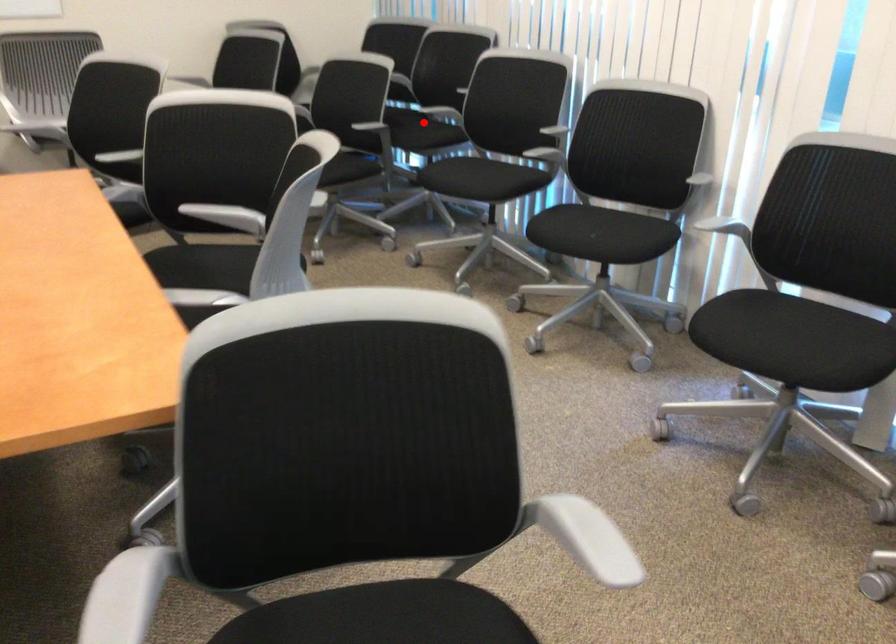
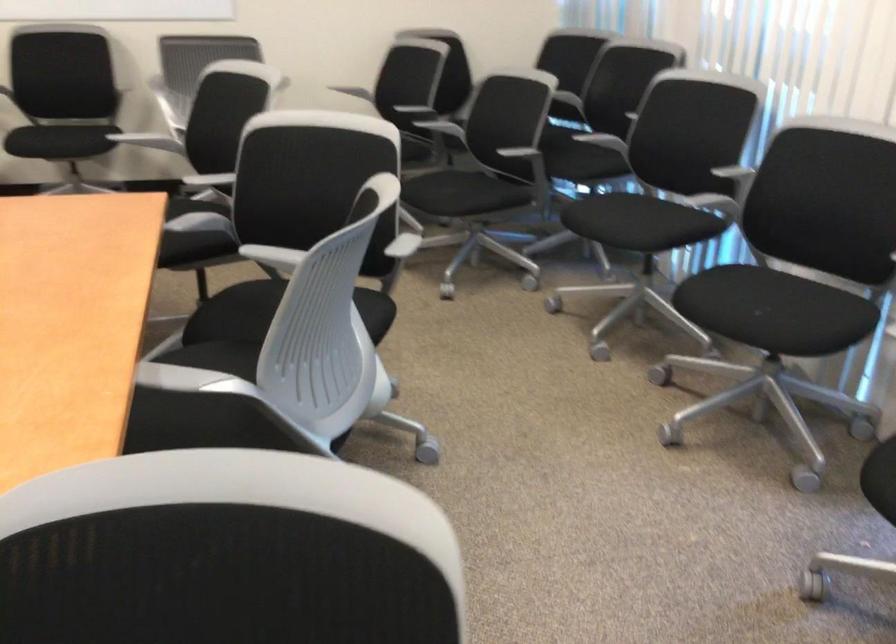
Question: I am providing you with two images of the same scene from different viewpoints. A red point is shown in image1. For the corresponding object point in image2, is it positioned nearer or farther from the camera?

Choices:
 (A) Nearer
 (B) Farther

Answer: (A)